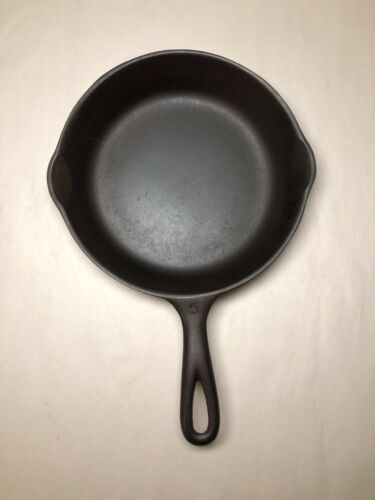
Mark all positions containing where to hang the pan in the image. Your answer should be formatted as a list of tuples, i.e. [(x1, y1), (x2, y2), ...], where each tuple contains the x and y coordinates of a point satisfying the conditions above.

[(197, 411)]